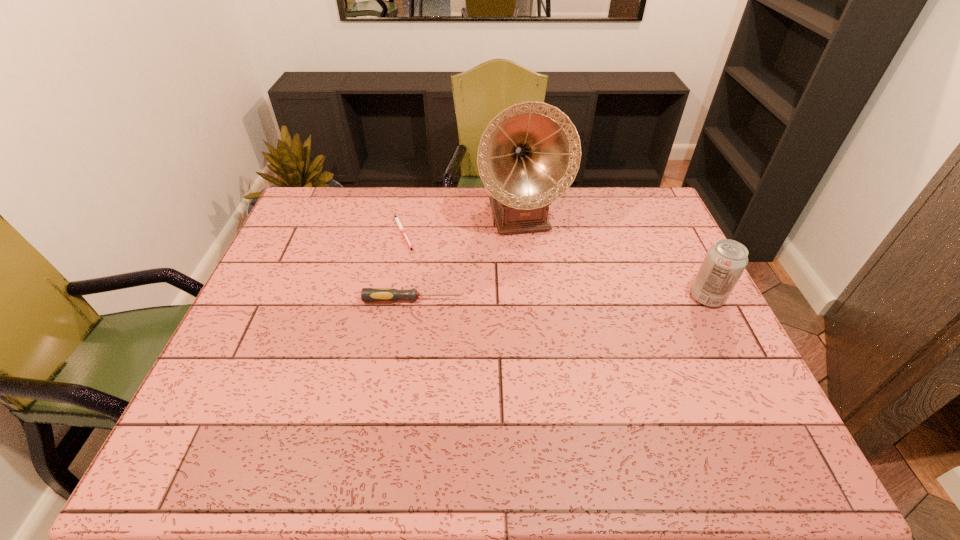
Where is `vacant point located 0.330m on the horn of the tallest object`? The width and height of the screenshot is (960, 540). vacant point located 0.330m on the horn of the tallest object is located at coordinates (559, 320).

Identify the location of free space located 0.180m on the clicker of the pen. (457, 266).

Where is `blank area located 0.240m on the clicker of the pen`? This screenshot has width=960, height=540. blank area located 0.240m on the clicker of the pen is located at coordinates (472, 273).

Where is `vacant space located 0.340m on the clicker of the pen`? vacant space located 0.340m on the clicker of the pen is located at coordinates point(500,287).

You are a GUI agent. You are given a task and a screenshot of the screen. Output one action in this format:
    pyautogui.click(x=<x>, y=<y>)
    Task: Click on the phonograph record located in the far edge section of the desktop
    This screenshot has width=960, height=540.
    Given the screenshot: What is the action you would take?
    pyautogui.click(x=528, y=156)

You are a GUI agent. You are given a task and a screenshot of the screen. Output one action in this format:
    pyautogui.click(x=<x>, y=<y>)
    Task: Click on the pen present at the far edge
    This screenshot has width=960, height=540.
    Given the screenshot: What is the action you would take?
    pyautogui.click(x=396, y=218)

Find the location of a particular element. object that is at the right edge is located at coordinates (725, 261).

Find the location of a particular element. free space at the far edge of the desktop is located at coordinates (375, 190).

The width and height of the screenshot is (960, 540). In the image, there is a desktop. Find the location of `vacant space at the near edge`. vacant space at the near edge is located at coordinates (489, 389).

The height and width of the screenshot is (540, 960). I want to click on vacant region at the left edge of the desktop, so click(333, 236).